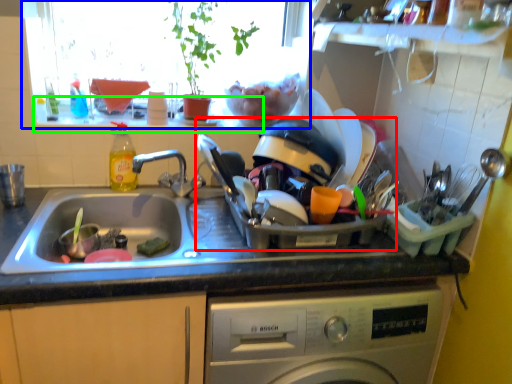
Question: Estimate the real-world distances between objects in this image. Which object is farther from appliance (highlighted by a red box), window screen (highlighted by a blue box) or window sill (highlighted by a green box)?

Choices:
 (A) window screen
 (B) window sill

Answer: (B)